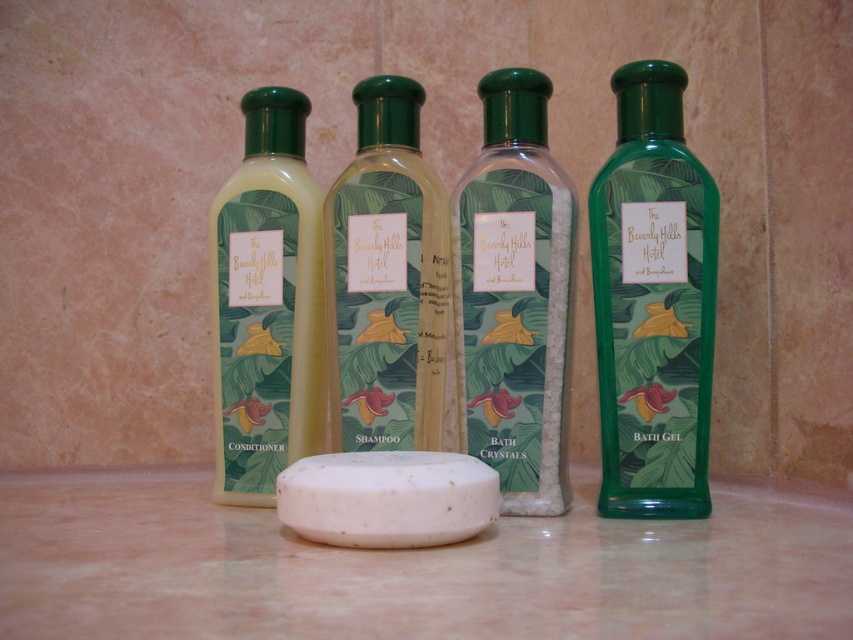
Question: Is green matte bath crystals at center in front of white matte soap at center?

Choices:
 (A) no
 (B) yes

Answer: (A)

Question: Which point is farther from the camera taking this photo?

Choices:
 (A) (321, 515)
 (B) (560, 401)

Answer: (B)

Question: Can you confirm if matte green plastic conditioner at left is thinner than white matte soap at center?

Choices:
 (A) no
 (B) yes

Answer: (B)

Question: Estimate the real-world distances between objects in this image. Which object is farther from the green matte shampoo at center?

Choices:
 (A) green matte bath gel at right
 (B) green matte bath crystals at center
 (C) white matte soap at center

Answer: (A)

Question: Which point is farther to the camera?

Choices:
 (A) (461, 280)
 (B) (357, 147)

Answer: (B)

Question: Does green matte bath gel at right come in front of green matte shampoo at center?

Choices:
 (A) no
 (B) yes

Answer: (B)